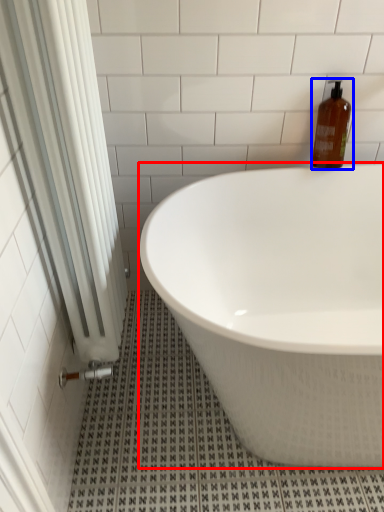
Question: Which point is further to the camera, bathtub (highlighted by a red box) or bottle (highlighted by a blue box)?

Choices:
 (A) bathtub
 (B) bottle

Answer: (B)